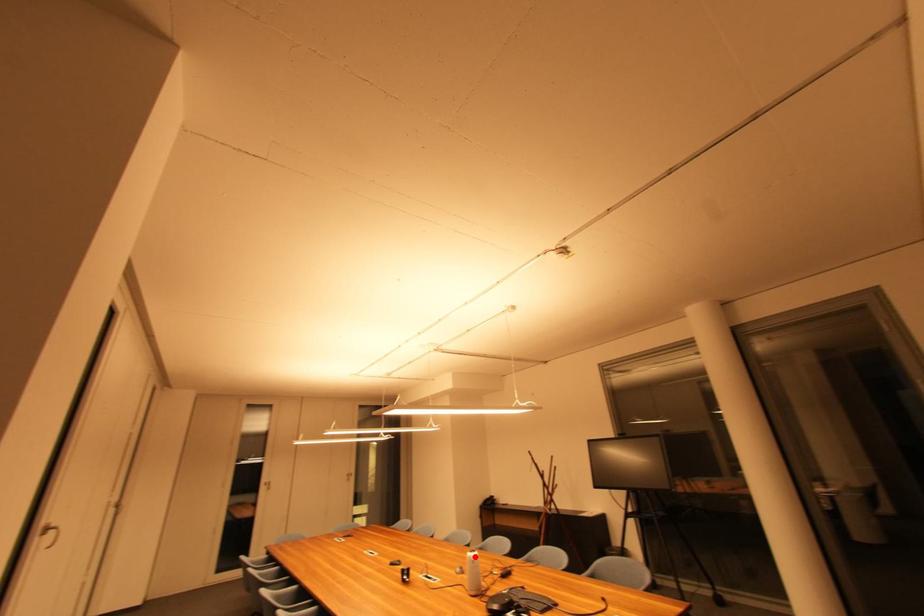
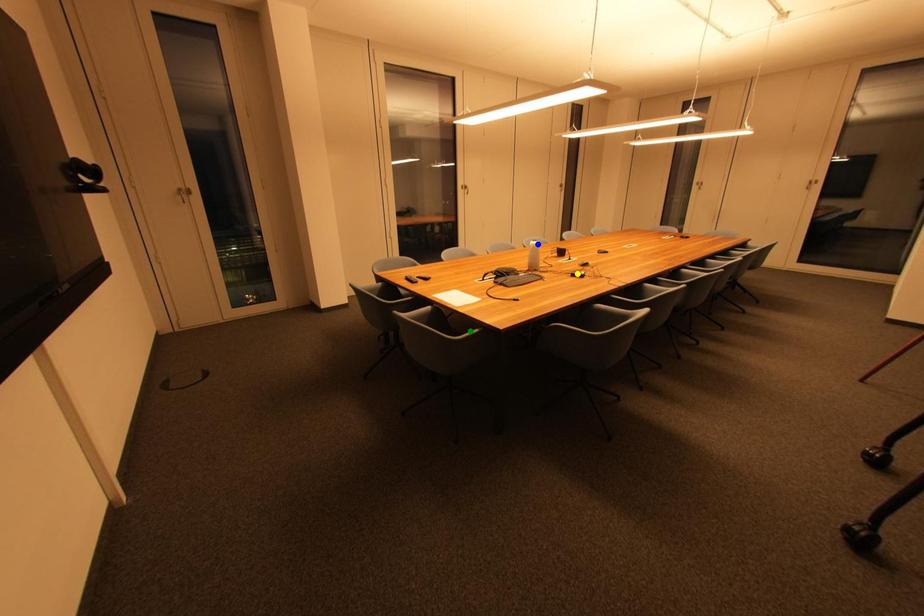
Question: I am providing you with two images of the same scene from different viewpoints. A red point is marked on the first image. You are given multiple points on the second image. Which point in image 2 is actually the same real-world point as the red point in image 1?

Choices:
 (A) yellow point
 (B) blue point
 (C) green point

Answer: (B)